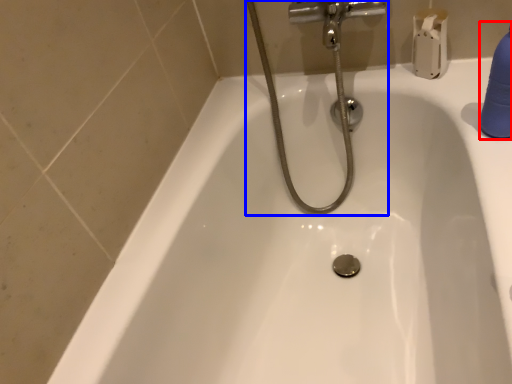
Question: Which object is further to the camera taking this photo, cleaning product (highlighted by a red box) or plumbing fixture (highlighted by a blue box)?

Choices:
 (A) cleaning product
 (B) plumbing fixture

Answer: (B)